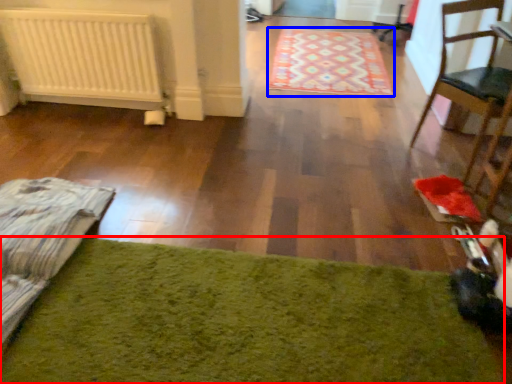
Question: Among these objects, which one is farthest to the camera, mat (highlighted by a red box) or mat (highlighted by a blue box)?

Choices:
 (A) mat
 (B) mat

Answer: (B)